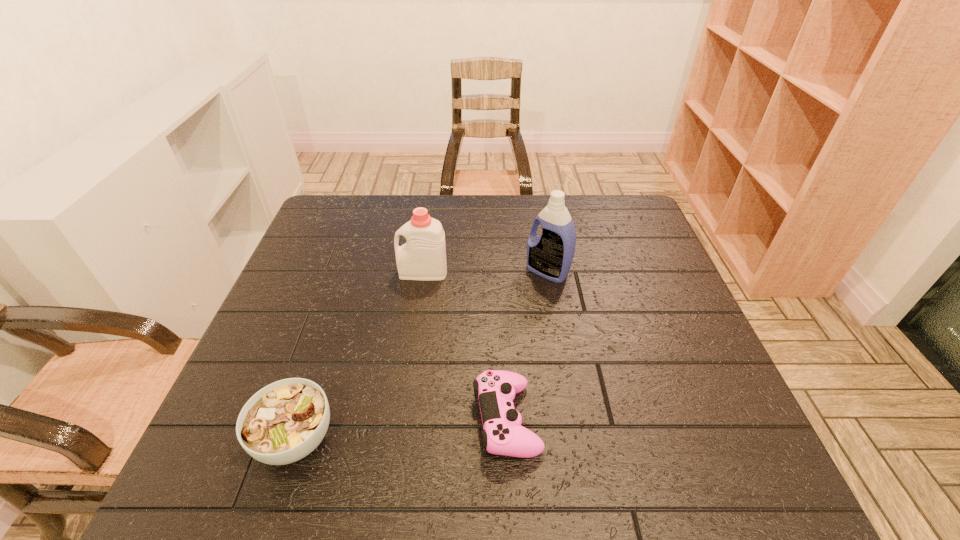
This screenshot has height=540, width=960. I want to click on vacant space that satisfies the following two spatial constraints: 1. on the back side of the control; 2. on the left side of the rightmost object, so click(499, 272).